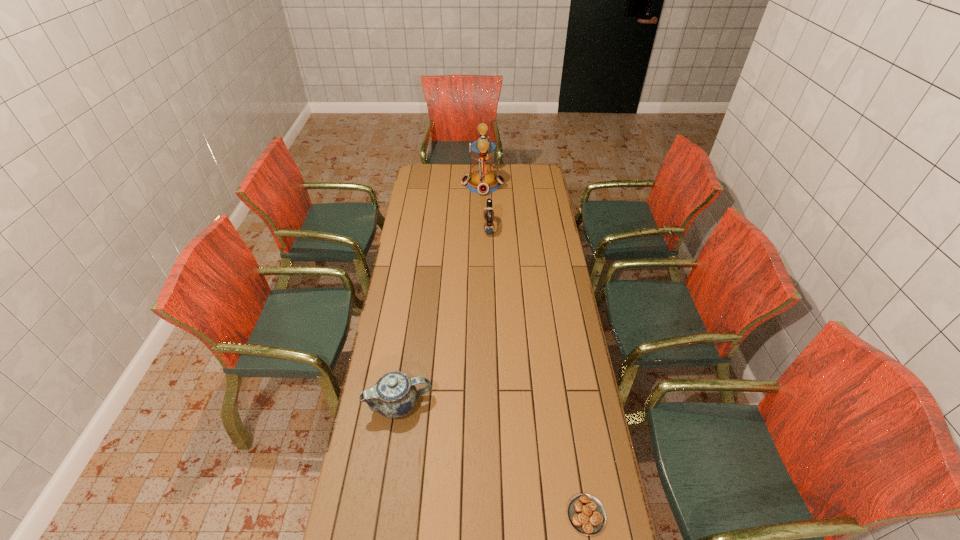
Identify the location of vacant space situated 0.210m on the ear cup of the headset. This screenshot has height=540, width=960. point(443,227).

Locate an element on the screen. The height and width of the screenshot is (540, 960). free space located 0.370m on the ear cup of the headset is located at coordinates (412, 227).

At what (x,y) coordinates should I click in order to perform the action: click on vacant region located on the ear cup of the headset. Please return your answer as a coordinate pair (x, y). Looking at the image, I should click on (425, 227).

At what (x,y) coordinates should I click in order to perform the action: click on vacant space located 0.160m from the spout of the chinaware. Please return your answer as a coordinate pair (x, y). The height and width of the screenshot is (540, 960). Looking at the image, I should click on (478, 404).

Where is `free space located 0.280m on the left of the nearest object`? Image resolution: width=960 pixels, height=540 pixels. free space located 0.280m on the left of the nearest object is located at coordinates (471, 515).

This screenshot has height=540, width=960. I want to click on object present at the far edge, so click(482, 180).

What are the coordinates of `object present at the left edge` in the screenshot? It's located at (394, 395).

Locate an element on the screen. The image size is (960, 540). object located in the right edge section of the desktop is located at coordinates (586, 514).

Locate an element on the screen. Image resolution: width=960 pixels, height=540 pixels. vacant area at the far edge is located at coordinates (511, 169).

Find the location of `vacant space at the left edge of the desktop`. vacant space at the left edge of the desktop is located at coordinates (377, 524).